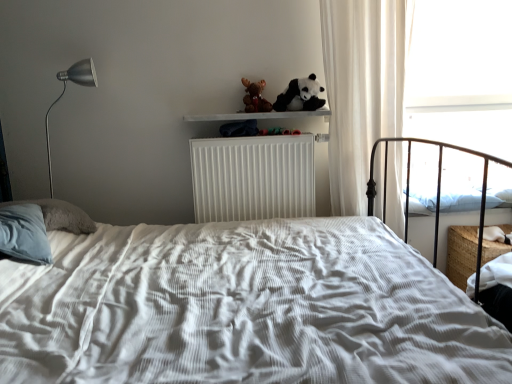
The image size is (512, 384). What do you see at coordinates (243, 309) in the screenshot?
I see `white textured bed at center` at bounding box center [243, 309].

What are the coordinates of `transparent glass window at upper right` in the screenshot? It's located at (461, 74).

From a real-world perspective, does white textured bed at center stand above white ribbed radiator at center?

No, from a real-world perspective, white textured bed at center is not over white ribbed radiator at center

Looking at this image, is white textured bed at center wider than white ribbed radiator at center?

Yes.

Is white textured bed at center not close to white ribbed radiator at center?

No, there isn't a large distance between white textured bed at center and white ribbed radiator at center.

I want to click on radiator behind the white textured bed at center, so click(253, 177).

Identify the location of curtain located on the right of soft plush panda at upper center. The width and height of the screenshot is (512, 384). (361, 90).

Does soft plush panda at upper center turn towards white sheer curtain at right?

No, soft plush panda at upper center is not aimed at white sheer curtain at right.

In terms of size, does soft plush panda at upper center appear bigger or smaller than white sheer curtain at right?

In the image, soft plush panda at upper center appears to be smaller than white sheer curtain at right.

Considering the sizes of objects soft plush panda at upper center and white sheer curtain at right in the image provided, who is wider, soft plush panda at upper center or white sheer curtain at right?

With larger width is white sheer curtain at right.

Considering the sizes of objects white ribbed radiator at center and white sheer curtain at right in the image provided, who is shorter, white ribbed radiator at center or white sheer curtain at right?

white ribbed radiator at center is shorter.

Could you tell me if white ribbed radiator at center is facing white sheer curtain at right?

No, white ribbed radiator at center is not oriented towards white sheer curtain at right.

From the image's perspective, is white ribbed radiator at center over white sheer curtain at right?

No, from the image's perspective, white ribbed radiator at center is not above white sheer curtain at right.

Would you say white sheer curtain at right is part of white ribbed radiator at center's contents?

No, white sheer curtain at right is located outside of white ribbed radiator at center.

Is white sheer curtain at right shorter than brown plush moose at upper center?

No, white sheer curtain at right is not shorter than brown plush moose at upper center.

Can you confirm if white sheer curtain at right is positioned to the right of brown plush moose at upper center?

Yes.

Between white sheer curtain at right and brown plush moose at upper center, which one has smaller size?

brown plush moose at upper center is smaller.

Is white sheer curtain at right aimed at brown plush moose at upper center?

No, white sheer curtain at right does not turn towards brown plush moose at upper center.

From a real-world perspective, is soft plush panda at upper center under brown plush moose at upper center?

Yes, from a real-world perspective, soft plush panda at upper center is beneath brown plush moose at upper center.

Is soft plush panda at upper center next to brown plush moose at upper center and touching it?

No.

Is soft plush panda at upper center positioned with its back to brown plush moose at upper center?

No.

Does point (291, 92) lie in front of point (253, 96)?

Yes, it is.

Is white sheer curtain at right not within white soft pillow at right?

white sheer curtain at right lies outside white soft pillow at right's area.

Is point (356, 149) closer to viewer compared to point (451, 200)?

Yes, point (356, 149) is closer to viewer.

Based on the photo, is white sheer curtain at right placed right next to white soft pillow at right?

No, white sheer curtain at right is not with white soft pillow at right.

Does white sheer curtain at right have a lesser width compared to white soft pillow at right?

Indeed, white sheer curtain at right has a lesser width compared to white soft pillow at right.

Considering the positions of objects white textured bed at center and brown plush moose at upper center in the image provided, who is more to the right, white textured bed at center or brown plush moose at upper center?

Positioned to the right is brown plush moose at upper center.

In terms of height, does white textured bed at center look taller or shorter compared to brown plush moose at upper center?

white textured bed at center is taller than brown plush moose at upper center.

Is point (132, 351) less distant than point (254, 102)?

Yes, point (132, 351) is in front of point (254, 102).

I want to click on bed that appears below the white ribbed radiator at center (from the image's perspective), so click(243, 309).

At what (x,y) coordinates should I click in order to perform the action: click on curtain that appears on the right of soft plush panda at upper center. Please return your answer as a coordinate pair (x, y). This screenshot has height=384, width=512. Looking at the image, I should click on (361, 90).

Based on their spatial positions, is white wooden shelf at upper center or soft plush panda at upper center further from white ribbed radiator at center?

The object further to white ribbed radiator at center is soft plush panda at upper center.

From the image, which object appears to be nearer to white sheer curtain at right, brown plush moose at upper center or soft plush panda at upper center?

Based on the image, soft plush panda at upper center appears to be nearer to white sheer curtain at right.

From the image, which object appears to be nearer to soft plush panda at upper center, white wooden shelf at upper center or transparent glass window at upper right?

Among the two, white wooden shelf at upper center is located nearer to soft plush panda at upper center.

Looking at the image, which one is located closer to white wooden shelf at upper center, white textured bed at center or brown plush moose at upper center?

brown plush moose at upper center lies closer to white wooden shelf at upper center than the other object.

Based on the photo, which object lies nearer to the anchor point white soft pillow at right, white sheer curtain at right or brown plush moose at upper center?

white sheer curtain at right is closer to white soft pillow at right.

Which object lies nearer to the anchor point transparent glass window at upper right, white wooden shelf at upper center or white sheer curtain at right?

Based on the image, white sheer curtain at right appears to be nearer to transparent glass window at upper right.

Considering their positions, is brown plush moose at upper center positioned further to soft plush panda at upper center than transparent glass window at upper right?

The object further to soft plush panda at upper center is transparent glass window at upper right.

Based on the photo, when comparing their distances from soft plush panda at upper center, does white ribbed radiator at center or transparent glass window at upper right seem closer?

white ribbed radiator at center.

This screenshot has height=384, width=512. I want to click on curtain between white ribbed radiator at center and white soft pillow at right in the horizontal direction, so click(361, 90).

What are the coordinates of `curtain between brown plush moose at upper center and white soft pillow at right` in the screenshot? It's located at (361, 90).

The width and height of the screenshot is (512, 384). I want to click on figurine situated between white wooden shelf at upper center and transparent glass window at upper right from left to right, so click(255, 97).

Find the location of a particular element. This screenshot has width=512, height=384. radiator between brown plush moose at upper center and transparent glass window at upper right is located at coordinates (253, 177).